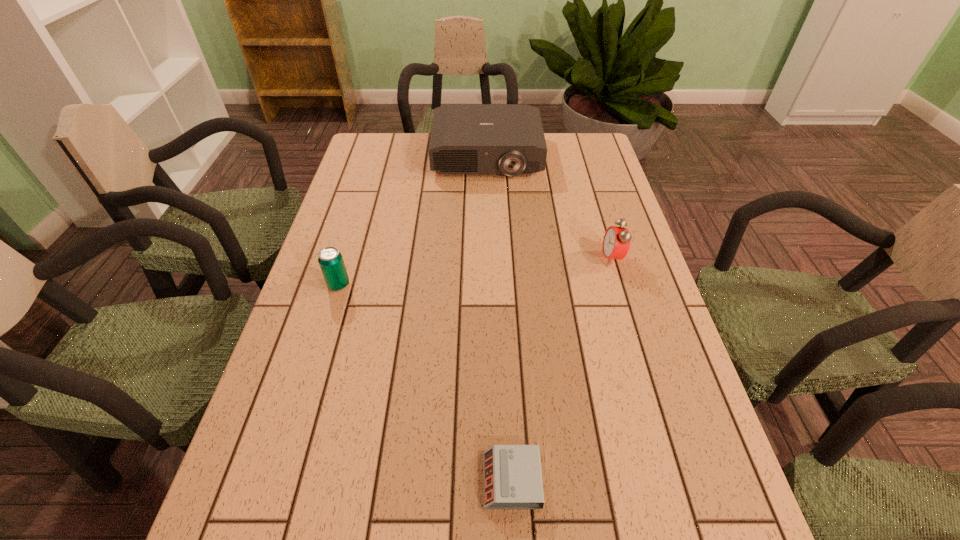
At what (x,y) coordinates should I click in order to perform the action: click on the second closest object relative to the beer can. Please return your answer as a coordinate pair (x, y). The width and height of the screenshot is (960, 540). Looking at the image, I should click on (512, 473).

The width and height of the screenshot is (960, 540). What are the coordinates of `vacant space that satisfies the following two spatial constraints: 1. on the front-facing side of the projector; 2. on the left side of the nearer alarm clock` in the screenshot? It's located at (493, 480).